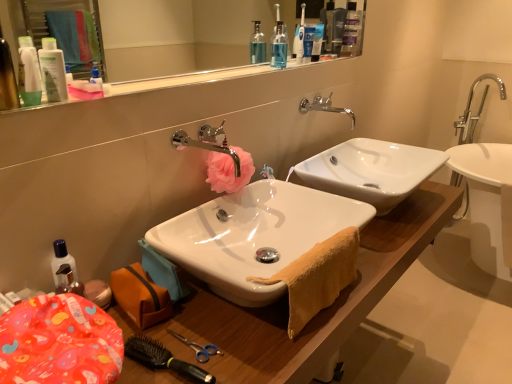
Identify the location of free space to the left of black plastic brush at lower left, placed as the second brush when sorted from front to back. (142, 338).